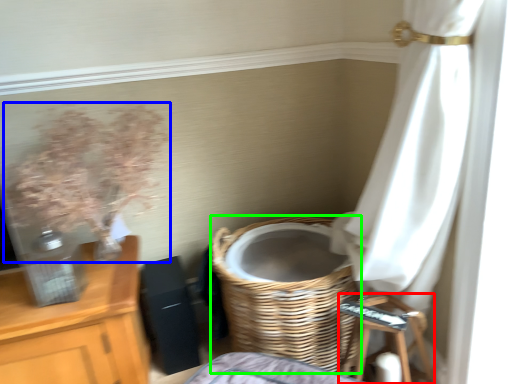
Question: Estimate the real-world distances between objects in this image. Which object is closer to step stool (highlighted by a red box), floral arrangement (highlighted by a blue box) or basket (highlighted by a green box)?

Choices:
 (A) floral arrangement
 (B) basket

Answer: (B)